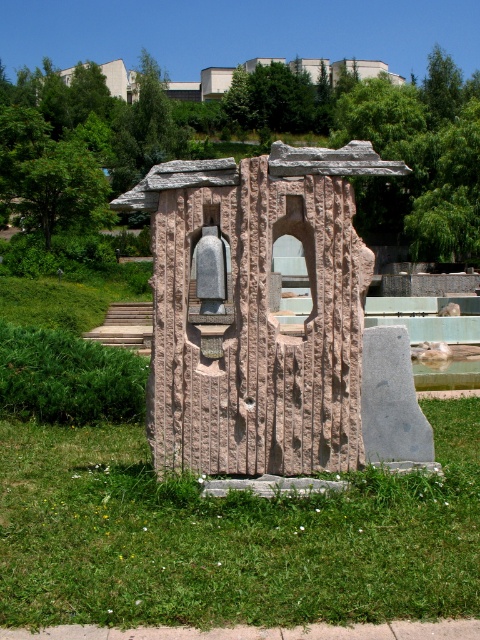
Question: Which of the following is the farthest from the observer?

Choices:
 (A) rough stone sculpture at center
 (B) green grass at center

Answer: (A)

Question: Is green grass at center to the right of rough stone sculpture at center from the viewer's perspective?

Choices:
 (A) yes
 (B) no

Answer: (A)

Question: Which point appears farthest from the camera in this image?

Choices:
 (A) (317, 156)
 (B) (85, 516)

Answer: (A)

Question: Among these objects, which one is nearest to the camera?

Choices:
 (A) rough stone sculpture at center
 (B) green grass at center

Answer: (B)

Question: Is green grass at center thinner than rough stone sculpture at center?

Choices:
 (A) yes
 (B) no

Answer: (B)

Question: From the image, what is the correct spatial relationship of green grass at center in relation to rough stone sculpture at center?

Choices:
 (A) above
 (B) below

Answer: (B)